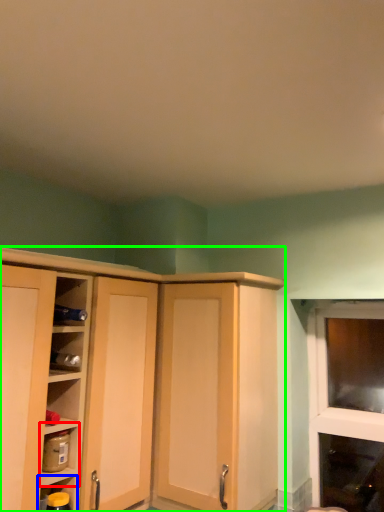
Question: Which object is the closest to the shelf (highlighted by a red box)? Choose among these: shelf (highlighted by a blue box) or cupboard (highlighted by a green box).

Choices:
 (A) shelf
 (B) cupboard

Answer: (A)